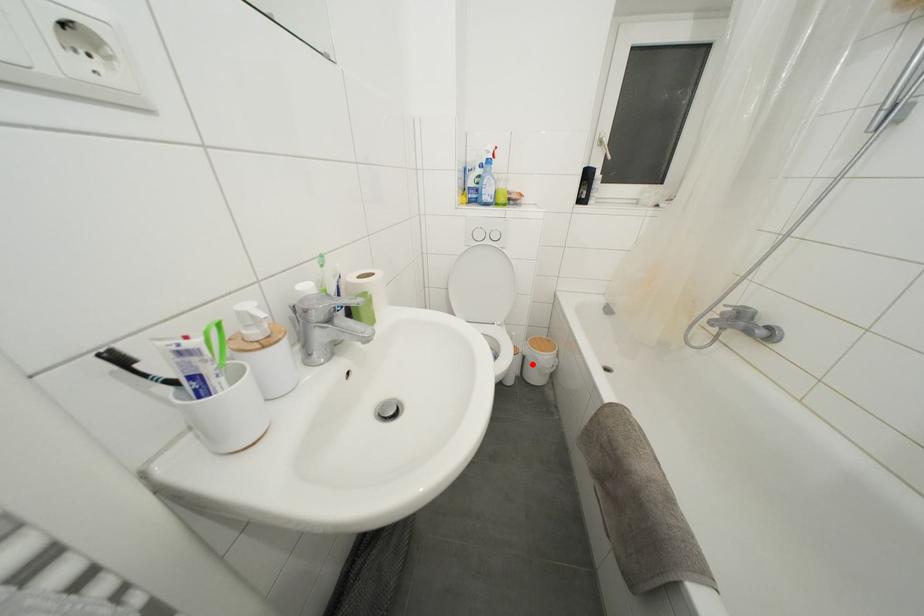
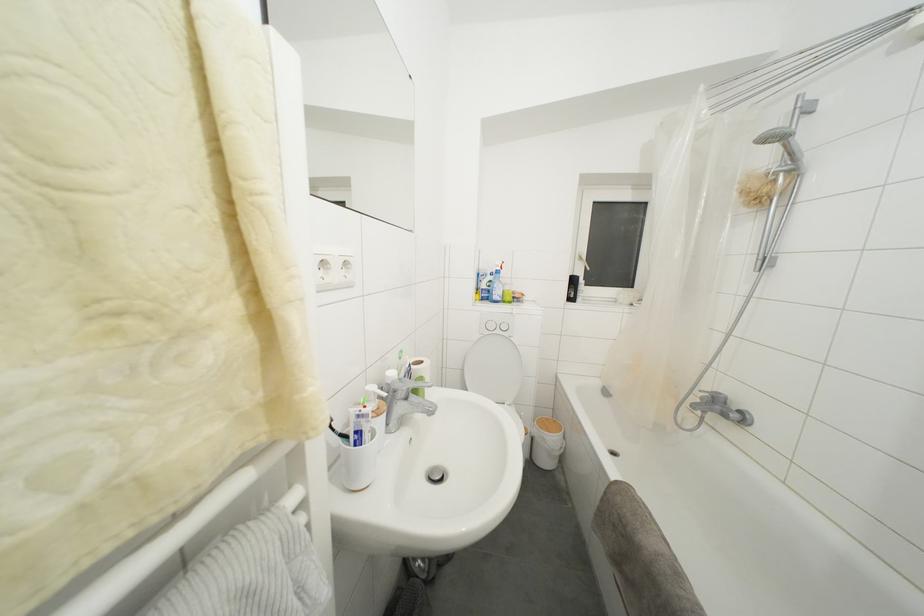
Where in the second image is the point corresponding to the highlighted location from the first image?

(541, 445)